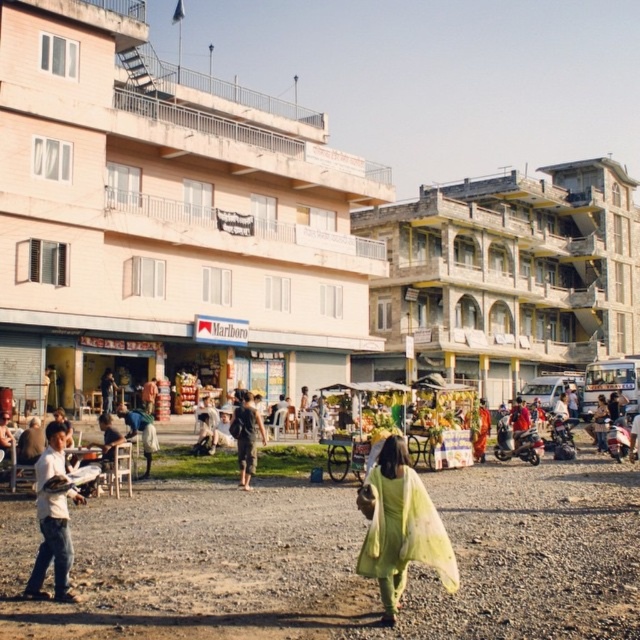
From the picture: You are a photographer trying to capture a person in the scene. You notice the light green fabric at center and the dark brown fabric pants at center. Which fabric is positioned higher on the person?

The light green fabric at center is much taller as dark brown fabric pants at center, so the light green fabric at center is positioned higher on the person.

You are a photographer trying to capture both the light green fabric at center and the white cotton shirt at lower left in the same frame. Given their sizes, which object will appear larger in the photo?

The light green fabric at center will appear larger in the photo because it is much taller than the white cotton shirt at lower left.

You are standing at point (45, 497) and want to walk to point (426, 547). Which direction should you move relative to the other point?

You should move forward towards point (426, 547) because it is in front of point (45, 497).